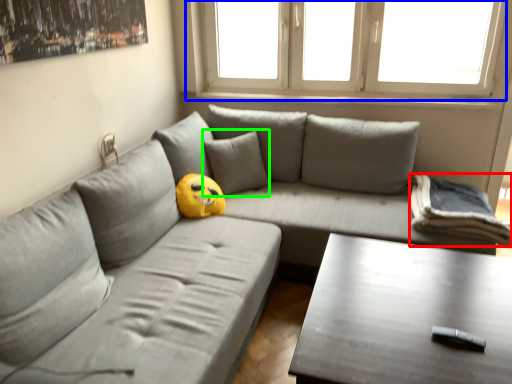
Question: Based on their relative distances, which object is farther from pillow (highlighted by a red box)? Choose from window (highlighted by a blue box) and pillow (highlighted by a green box).

Choices:
 (A) window
 (B) pillow

Answer: (A)